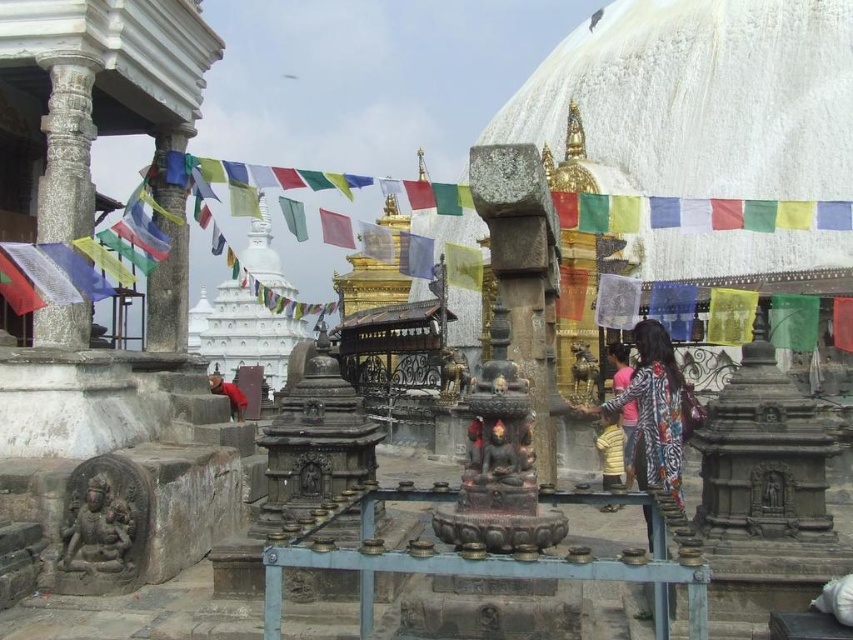
Question: Which point is farther from the camera taking this photo?

Choices:
 (A) (679, 444)
 (B) (549, 406)
 (C) (173, 337)
 (D) (88, 216)

Answer: (C)

Question: Which object is positioned farthest from the dark brown stone statue at lower left?

Choices:
 (A) pink fabric at center
 (B) red fabric person at lower left
 (C) yellow cotton shirt at center
 (D) printed fabric dress at center

Answer: (A)

Question: Can you confirm if black stone statue at center is positioned below pink fabric at center?

Choices:
 (A) no
 (B) yes

Answer: (A)

Question: Is black stone statue at center wider than red fabric person at lower left?

Choices:
 (A) yes
 (B) no

Answer: (B)

Question: Estimate the real-world distances between objects in this image. Which object is closer to the printed fabric dress at center?

Choices:
 (A) red fabric person at lower left
 (B) dark brown stone statue at lower left
 (C) matte black statue at center

Answer: (C)

Question: Is black stone statue at center above yellow cotton shirt at center?

Choices:
 (A) no
 (B) yes

Answer: (B)